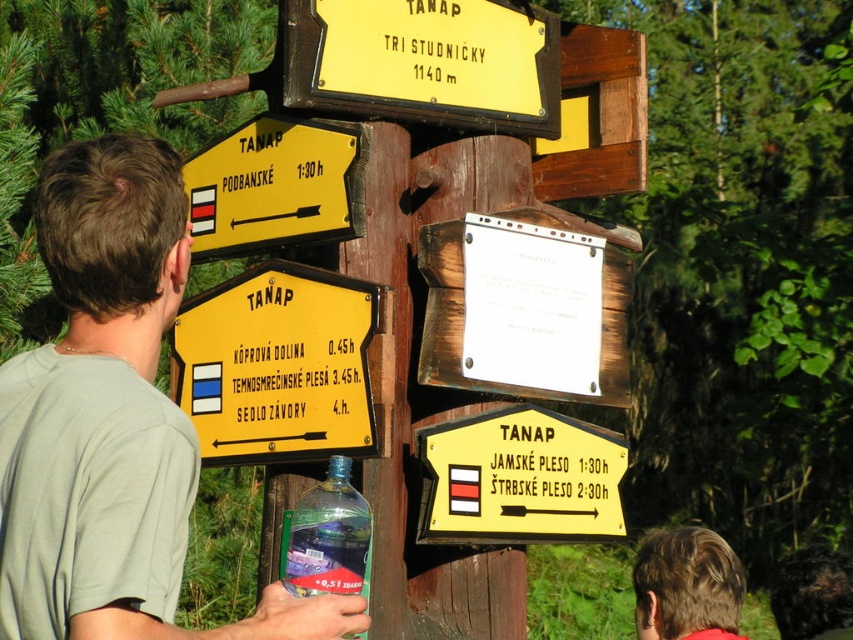
Question: Which point appears farthest from the camera in this image?

Choices:
 (A) (289, 209)
 (B) (199, 448)

Answer: (A)

Question: Considering the real-world distances, which object is closest to the green cotton shirt at upper left?

Choices:
 (A) translucent plastic bottle at center
 (B) yellow plastic sign at upper center
 (C) yellow painted wood sign at center

Answer: (A)

Question: Does yellow plastic sign at upper center appear under yellow plastic sign at upper left?

Choices:
 (A) yes
 (B) no

Answer: (B)

Question: Is green cotton shirt at upper left to the left of yellow plastic sign at upper center from the viewer's perspective?

Choices:
 (A) no
 (B) yes

Answer: (B)

Question: Which object appears farthest from the camera in this image?

Choices:
 (A) yellow plastic sign at upper left
 (B) blonde hair at upper right
 (C) yellow matte signpost at center
 (D) yellow painted wood sign at center

Answer: (B)

Question: Can you confirm if yellow plastic sign at upper center is thinner than translucent plastic bottle at center?

Choices:
 (A) yes
 (B) no

Answer: (B)